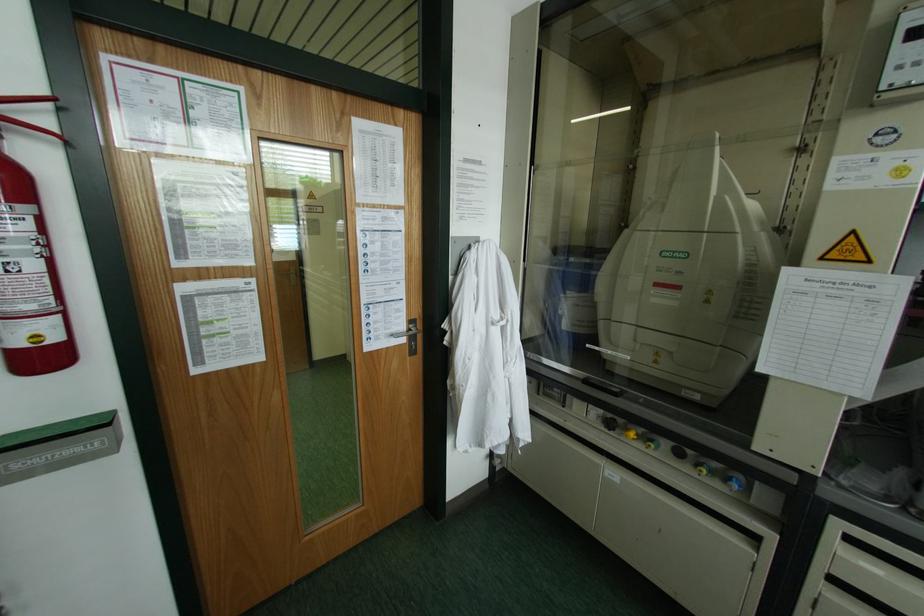
Image resolution: width=924 pixels, height=616 pixels. Find the location of `fume hood sash`. fume hood sash is located at coordinates (485, 353).